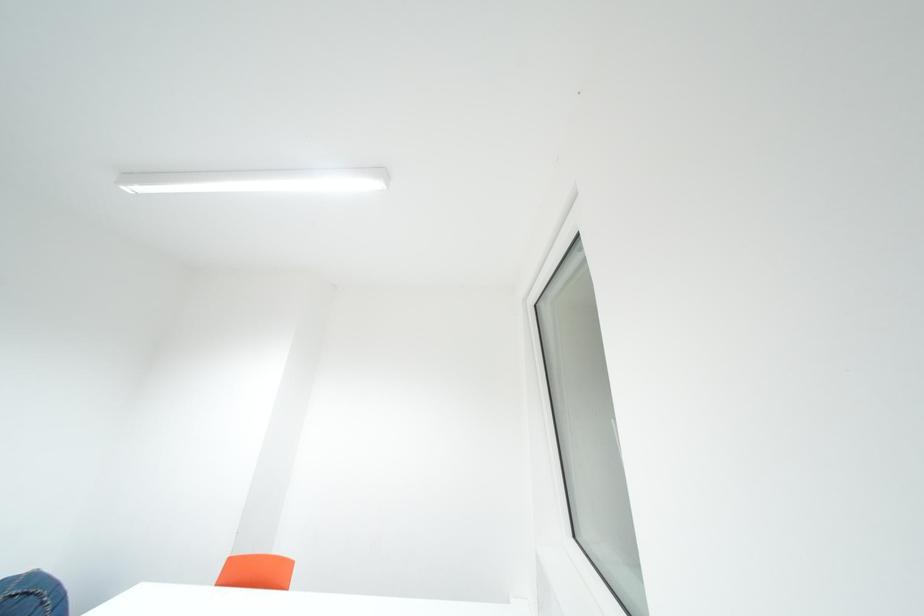
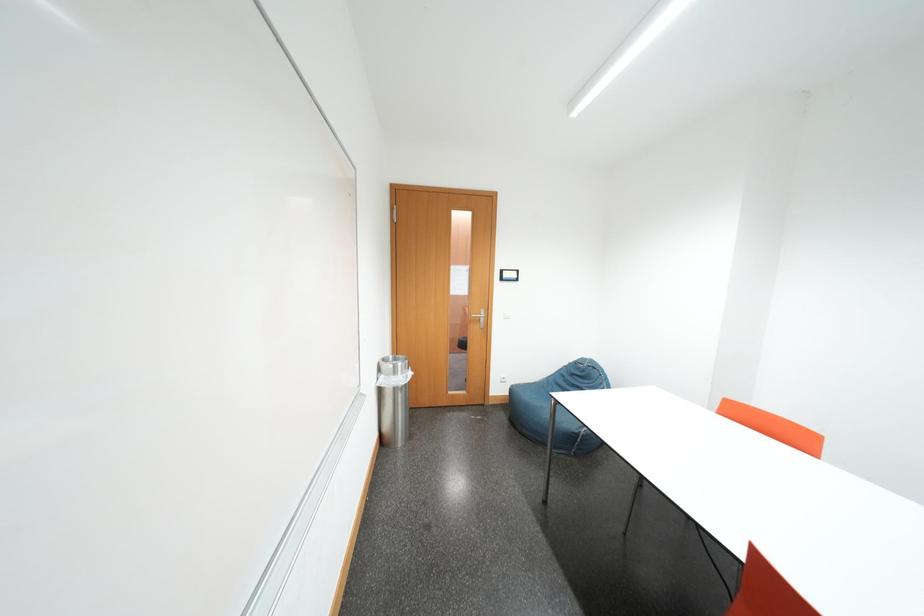
Question: How did the camera likely rotate?

Choices:
 (A) Left
 (B) Right
 (C) Up
 (D) Down

Answer: (A)